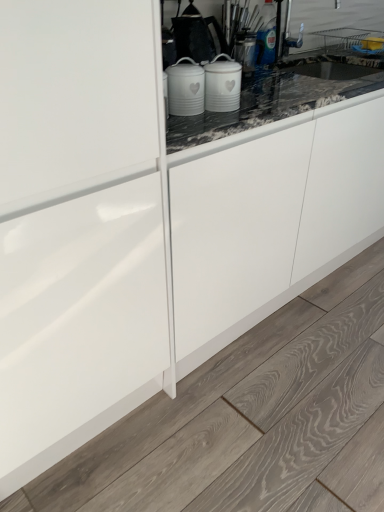
Question: Can you confirm if white matte canisters at center is smaller than white matte canisters at center?

Choices:
 (A) no
 (B) yes

Answer: (B)

Question: Can you confirm if white matte canisters at center is positioned to the left of white matte canisters at center?

Choices:
 (A) yes
 (B) no

Answer: (B)

Question: Could you tell me if white matte canisters at center is facing white matte canisters at center?

Choices:
 (A) yes
 (B) no

Answer: (B)

Question: From a real-world perspective, is white matte canisters at center positioned over white matte canisters at center based on gravity?

Choices:
 (A) yes
 (B) no

Answer: (B)

Question: Would you say white matte canisters at center is part of white matte canisters at center's contents?

Choices:
 (A) no
 (B) yes

Answer: (A)

Question: From a real-world perspective, is white matte canisters at center positioned under white matte canisters at center based on gravity?

Choices:
 (A) no
 (B) yes

Answer: (B)

Question: Is white matte canisters at center bigger than white matte canisters at center?

Choices:
 (A) yes
 (B) no

Answer: (A)

Question: Is white matte canisters at center closer to the viewer compared to white matte canisters at center?

Choices:
 (A) no
 (B) yes

Answer: (B)

Question: Considering the relative sizes of white matte canisters at center and white matte canisters at center in the image provided, is white matte canisters at center shorter than white matte canisters at center?

Choices:
 (A) yes
 (B) no

Answer: (B)

Question: Is white matte canisters at center to the left of white matte canisters at center from the viewer's perspective?

Choices:
 (A) yes
 (B) no

Answer: (A)

Question: From the image's perspective, is white matte canisters at center beneath white matte canisters at center?

Choices:
 (A) yes
 (B) no

Answer: (A)

Question: Considering the relative positions of white matte canisters at center and white matte canisters at center in the image provided, is white matte canisters at center to the right of white matte canisters at center from the viewer's perspective?

Choices:
 (A) yes
 (B) no

Answer: (B)

Question: In the image, is white matte canisters at center on the left side or the right side of white matte canisters at center?

Choices:
 (A) left
 (B) right

Answer: (B)